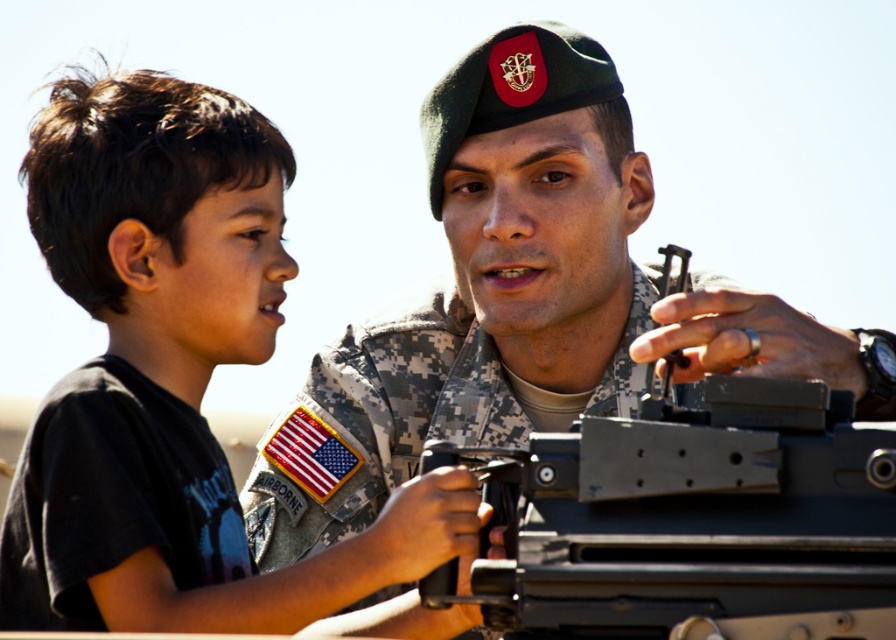
Consider the image. Is black matte shirt at left smaller than camouflage uniform at center?

Yes.

Which is in front, point (276, 240) or point (502, 419)?

Point (276, 240) is in front.

Who is more forward, (x=82, y=368) or (x=282, y=552)?

Point (x=82, y=368) is in front.

At what (x,y) coordinates should I click in order to perform the action: click on black matte shirt at left. Please return your answer as a coordinate pair (x, y). Looking at the image, I should click on (173, 378).

Is camouflage uniform at center positioned before black matte t-shirt at left?

That is False.

Which is above, camouflage uniform at center or black matte t-shirt at left?

camouflage uniform at center

The width and height of the screenshot is (896, 640). Identify the location of camouflage uniform at center. (522, 300).

The width and height of the screenshot is (896, 640). What are the coordinates of `camouflage uniform at center` in the screenshot? It's located at (522, 300).

Is point (65, 209) behind point (100, 490)?

Yes, point (65, 209) is behind point (100, 490).

Looking at this image, does black matte shirt at left appear on the right side of black matte t-shirt at left?

Correct, you'll find black matte shirt at left to the right of black matte t-shirt at left.

I want to click on black matte shirt at left, so click(x=173, y=378).